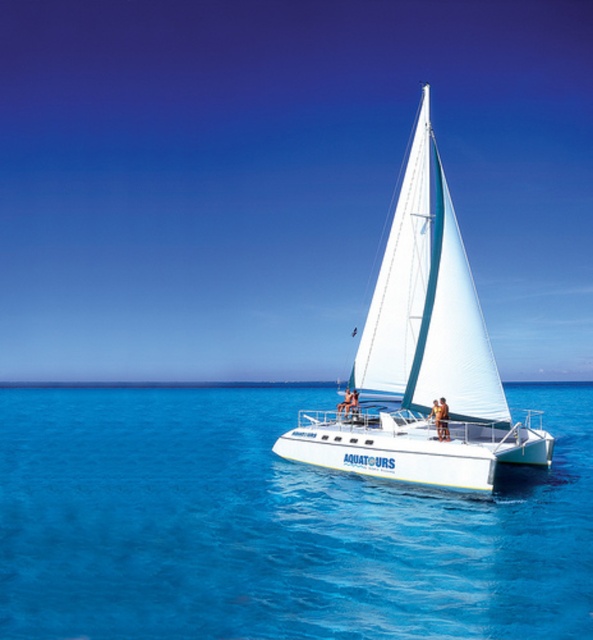
Between blue liquid water at center and white matte sailboat at center, which one is positioned higher?

white matte sailboat at center is above.

From the picture: Between blue liquid water at center and white matte sailboat at center, which one has less height?

With less height is blue liquid water at center.

Which is behind, point (33, 502) or point (396, 292)?

Positioned behind is point (396, 292).

Where is `blue liquid water at center`? blue liquid water at center is located at coordinates (275, 525).